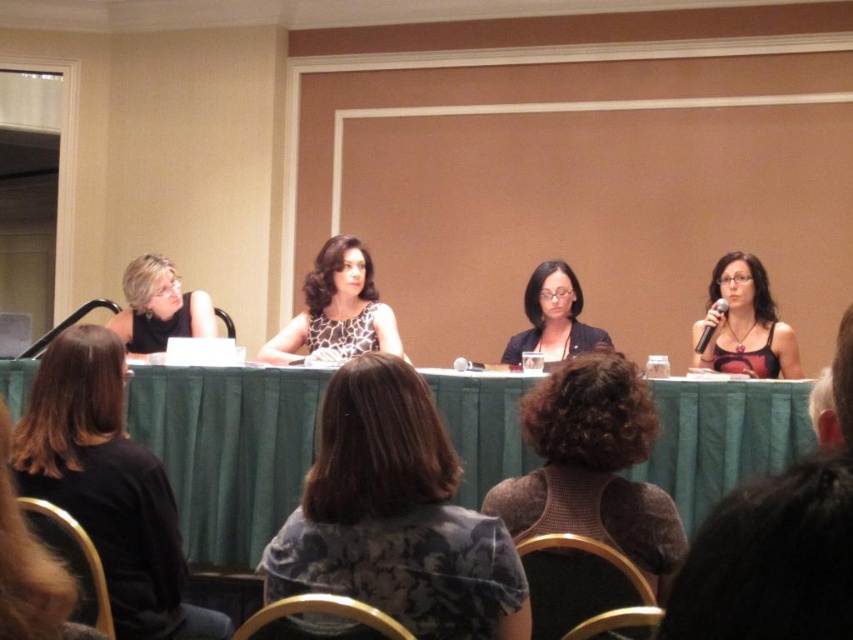
Can you confirm if dark gray textured blouse at center is positioned to the right of matte black laptop at left?

Indeed, dark gray textured blouse at center is positioned on the right side of matte black laptop at left.

Is dark gray textured blouse at center below matte black laptop at left?

Yes.

Does point (386, 371) come behind point (144, 307)?

That is False.

Locate an element on the screen. The width and height of the screenshot is (853, 640). dark gray textured blouse at center is located at coordinates (395, 516).

Does glossy leopard print dress at center have a greater height compared to matte black laptop at left?

Indeed, glossy leopard print dress at center has a greater height compared to matte black laptop at left.

This screenshot has width=853, height=640. What do you see at coordinates (337, 310) in the screenshot?
I see `glossy leopard print dress at center` at bounding box center [337, 310].

The image size is (853, 640). What are the coordinates of `glossy leopard print dress at center` in the screenshot? It's located at (337, 310).

Does dark gray textured blouse at center appear on the right side of matte black tank top at right?

In fact, dark gray textured blouse at center is to the left of matte black tank top at right.

What do you see at coordinates (395, 516) in the screenshot? The height and width of the screenshot is (640, 853). I see `dark gray textured blouse at center` at bounding box center [395, 516].

Identify the location of dark gray textured blouse at center. (395, 516).